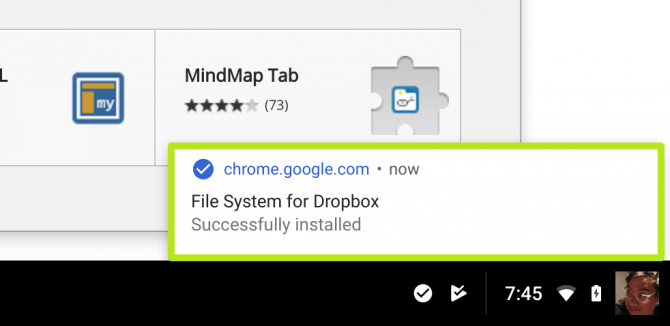
Find the location of a particular element. This screenshot has height=326, width=670. picture is located at coordinates (640, 280).